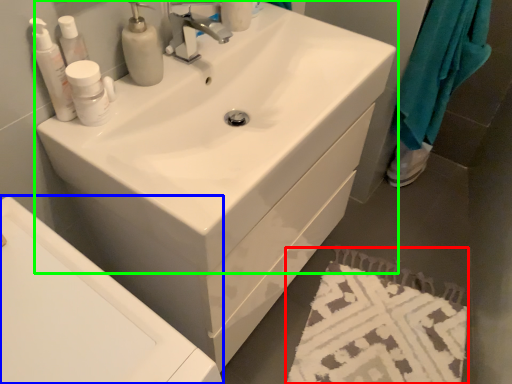
Question: Considering the real-world distances, which object is farthest from bath mat (highlighted by a red box)? bath (highlighted by a blue box) or sink (highlighted by a green box)?

Choices:
 (A) bath
 (B) sink

Answer: (A)